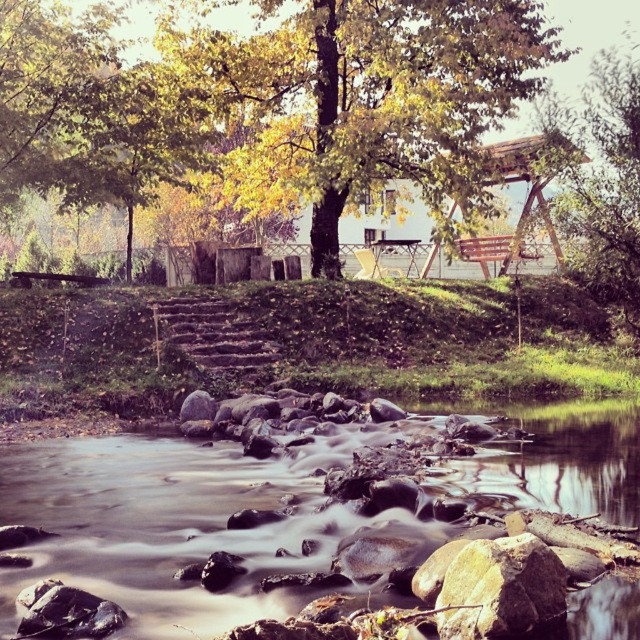
Question: Is yellow-green leaves at upper center bigger than brown wooden stairs at center?

Choices:
 (A) no
 (B) yes

Answer: (B)

Question: Which object is closer to the camera taking this photo?

Choices:
 (A) smooth rock river at lower center
 (B) brown wooden stairs at center

Answer: (A)

Question: Is yellow-green leaves at upper center bigger than brown wooden stairs at center?

Choices:
 (A) yes
 (B) no

Answer: (A)

Question: Which point is farther from the camera taking this photo?

Choices:
 (A) (593, 244)
 (B) (216, 360)
 (C) (525, 506)

Answer: (A)

Question: Among these points, which one is farthest from the camera?

Choices:
 (A) coord(182,324)
 (B) coord(560,225)
 (C) coord(140,616)

Answer: (B)

Question: Does smooth rock river at lower center lie in front of yellow-green leaves at upper center?

Choices:
 (A) yes
 (B) no

Answer: (A)